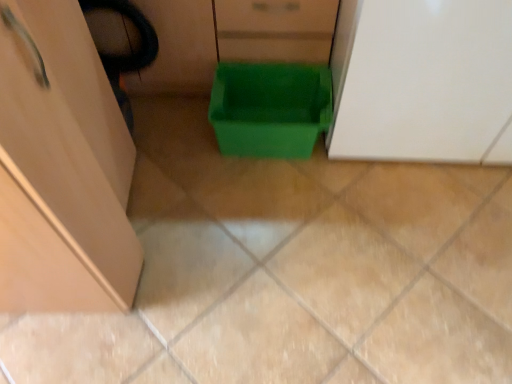
Question: Should I look upward or downward to see white glossy cabinet at upper right?

Choices:
 (A) up
 (B) down

Answer: (A)

Question: From a real-world perspective, is green plastic bin at center located beneath white glossy cabinet at upper right?

Choices:
 (A) yes
 (B) no

Answer: (A)

Question: Is green plastic bin at center thinner than white glossy cabinet at upper right?

Choices:
 (A) no
 (B) yes

Answer: (B)

Question: Considering the relative sizes of green plastic bin at center and white glossy cabinet at upper right in the image provided, is green plastic bin at center shorter than white glossy cabinet at upper right?

Choices:
 (A) yes
 (B) no

Answer: (A)

Question: Does green plastic bin at center turn towards white glossy cabinet at upper right?

Choices:
 (A) yes
 (B) no

Answer: (B)

Question: From the image's perspective, does green plastic bin at center appear lower than white glossy cabinet at upper right?

Choices:
 (A) yes
 (B) no

Answer: (A)

Question: Does green plastic bin at center have a greater height compared to white glossy cabinet at upper right?

Choices:
 (A) no
 (B) yes

Answer: (A)

Question: Is white glossy cabinet at upper right not near green plastic bin at center?

Choices:
 (A) no
 (B) yes

Answer: (A)

Question: Considering the relative positions of white glossy cabinet at upper right and green plastic bin at center in the image provided, is white glossy cabinet at upper right to the right of green plastic bin at center from the viewer's perspective?

Choices:
 (A) yes
 (B) no

Answer: (A)

Question: Can you confirm if white glossy cabinet at upper right is taller than green plastic bin at center?

Choices:
 (A) no
 (B) yes

Answer: (B)

Question: Is white glossy cabinet at upper right bigger than green plastic bin at center?

Choices:
 (A) yes
 (B) no

Answer: (A)

Question: Does white glossy cabinet at upper right have a lesser width compared to green plastic bin at center?

Choices:
 (A) yes
 (B) no

Answer: (B)

Question: Is green plastic bin at center at the back of white glossy cabinet at upper right?

Choices:
 (A) no
 (B) yes

Answer: (A)

Question: Is green plastic bin at center in front of or behind white glossy cabinet at upper right in the image?

Choices:
 (A) behind
 (B) front

Answer: (A)